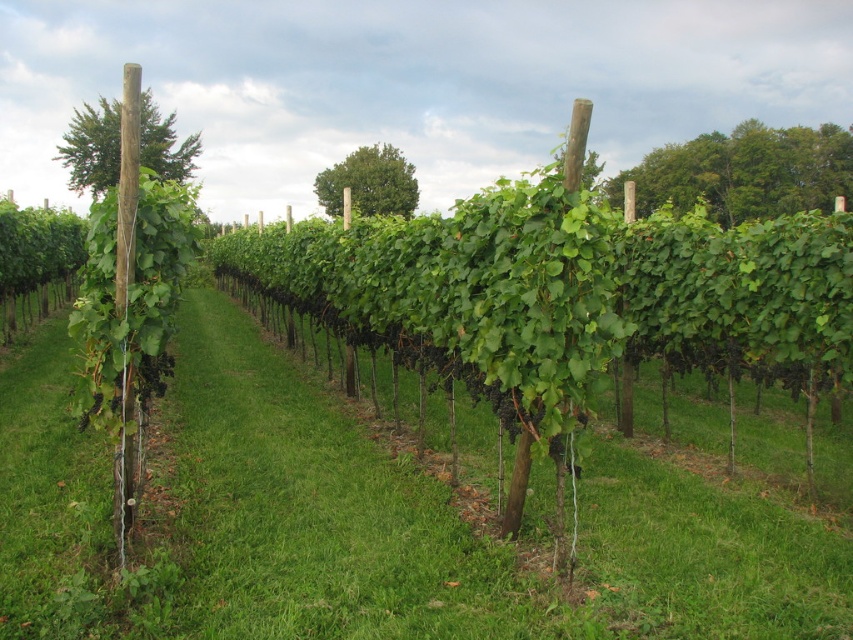
Who is lower down, green leafy tree at upper right or green leafy tree at center?

green leafy tree at center is lower down.

Can you confirm if green leafy tree at upper right is positioned above green leafy tree at center?

Indeed, green leafy tree at upper right is positioned over green leafy tree at center.

This screenshot has width=853, height=640. Find the location of `green leafy tree at upper right`. green leafy tree at upper right is located at coordinates (744, 172).

Based on the photo, measure the distance between green leafy tree at upper right and green leafy tree at upper left.

green leafy tree at upper right and green leafy tree at upper left are 34.65 meters apart from each other.

Measure the distance between point [726,138] and camera.

60.20 meters

Who is more distant from viewer, (708, 177) or (180, 170)?

Positioned behind is point (708, 177).

Find the location of a particular element. green leafy tree at upper right is located at coordinates (744, 172).

Is green leafy tree at upper left bigger than green leafy tree at center?

Yes, green leafy tree at upper left is bigger than green leafy tree at center.

Can you confirm if green leafy tree at upper left is smaller than green leafy tree at center?

No.

Where is `green leafy tree at upper left`? This screenshot has height=640, width=853. green leafy tree at upper left is located at coordinates (91, 147).